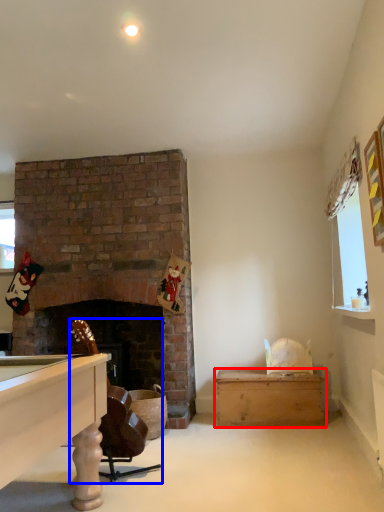
Question: Which of the following is the closest to the observer, table (highlighted by a red box) or rocking chair (highlighted by a blue box)?

Choices:
 (A) table
 (B) rocking chair

Answer: (B)